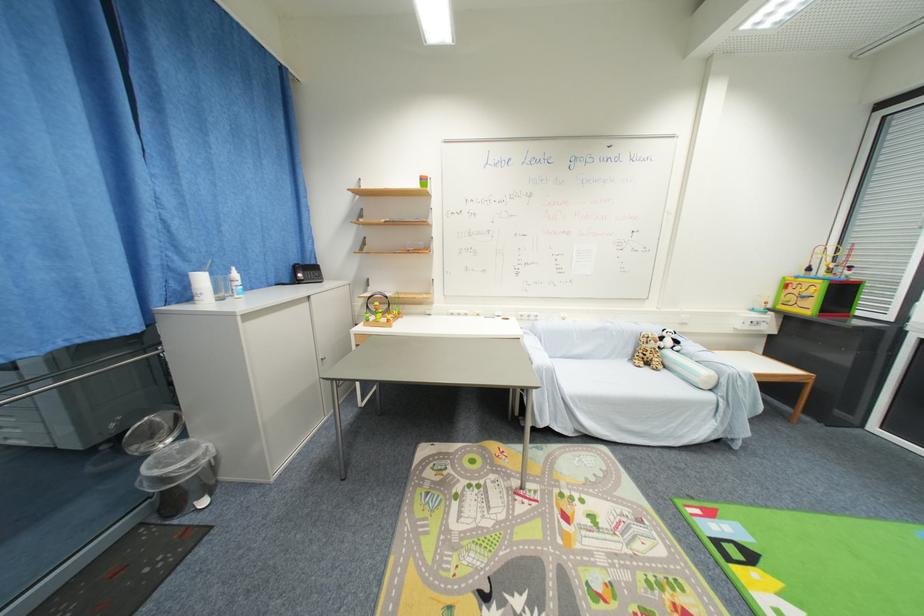
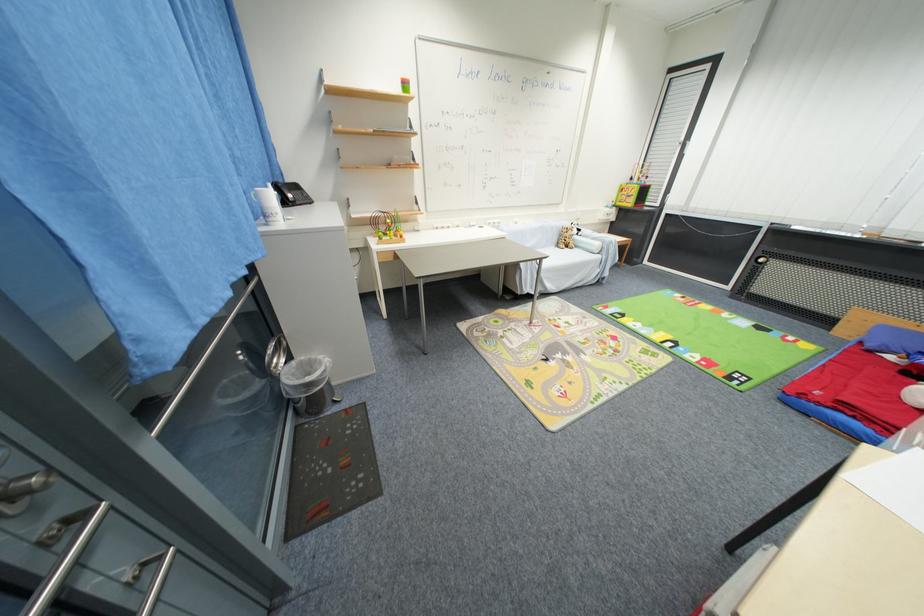
The point at (638, 361) is marked in the first image. Where is the corresponding point in the second image?

(563, 246)